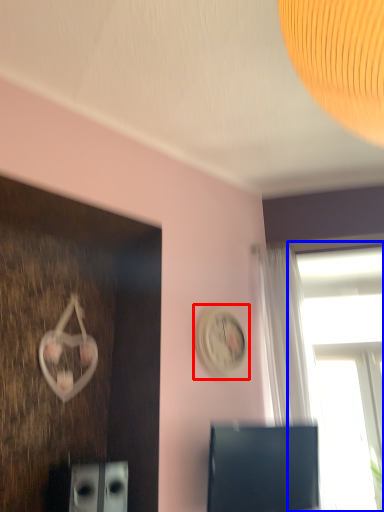
Question: Which of the following is the farthest to the observer, clock (highlighted by a red box) or window (highlighted by a blue box)?

Choices:
 (A) clock
 (B) window

Answer: (B)